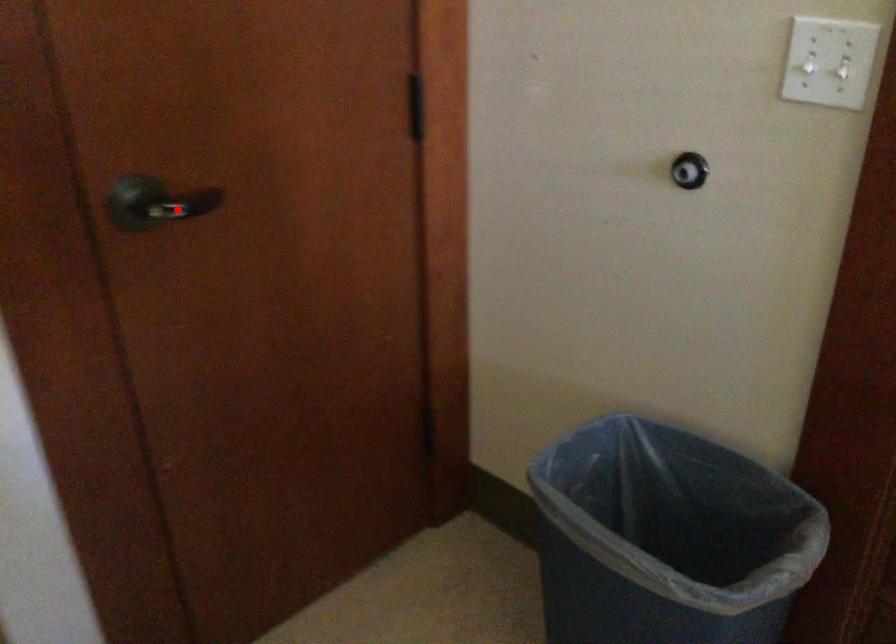
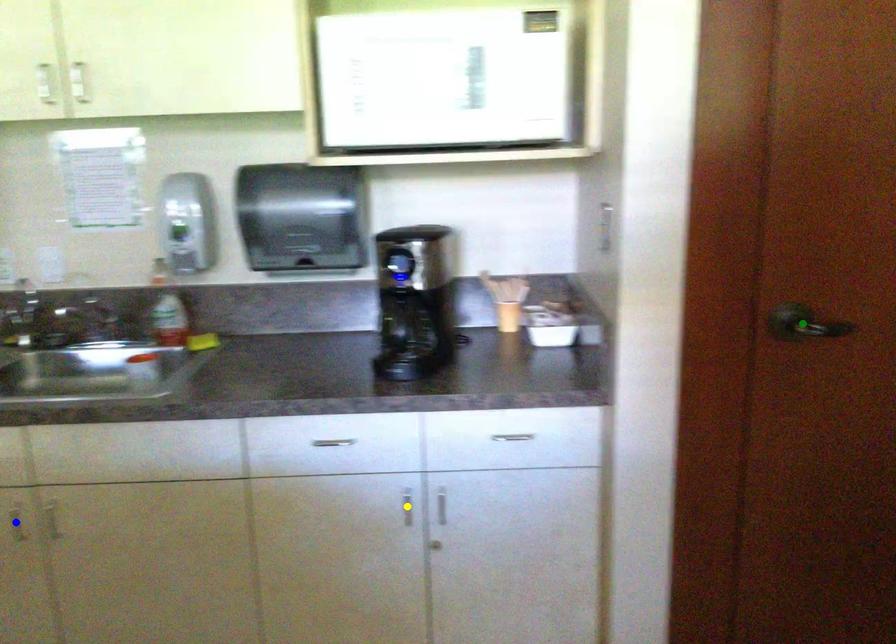
Question: I am providing you with two images of the same scene from different viewpoints. A red point is marked on the first image. You are given multiple points on the second image. Which point in image 2 is actually the same real-world point as the red point in image 1?

Choices:
 (A) green point
 (B) yellow point
 (C) blue point

Answer: (A)